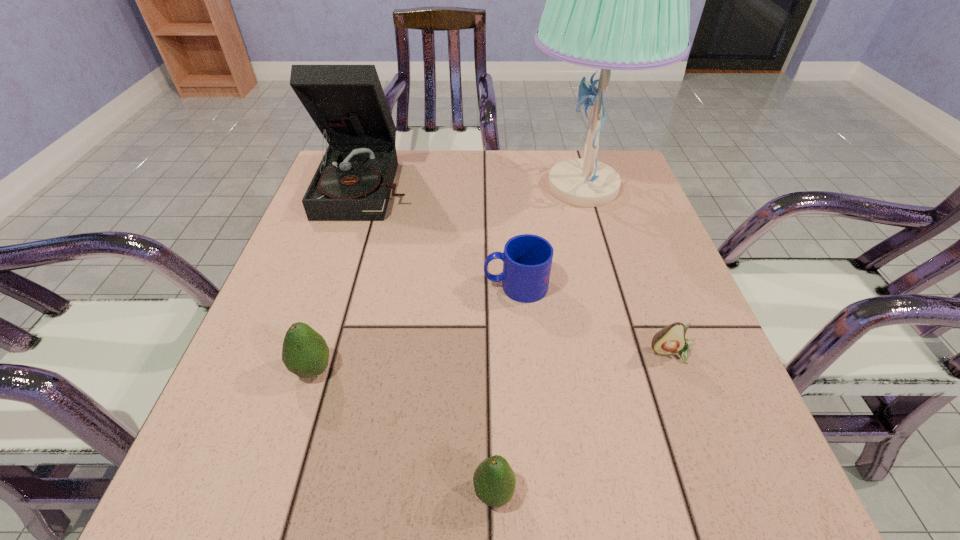
You are a GUI agent. You are given a task and a screenshot of the screen. Output one action in this format:
    pyautogui.click(x=<x>, y=<y>)
    Task: Click on the tallest object
    The height and width of the screenshot is (540, 960).
    Given the screenshot: What is the action you would take?
    pyautogui.click(x=616, y=0)

Image resolution: width=960 pixels, height=540 pixels. Identify the location of the second tallest object. (353, 182).

Where is `the tallest avocado`? The image size is (960, 540). the tallest avocado is located at coordinates (305, 353).

Image resolution: width=960 pixels, height=540 pixels. Identify the location of mug. (527, 259).

I want to click on the rightmost avocado, so click(671, 339).

Locate an element on the screen. the nearest avocado is located at coordinates (494, 481).

Locate an element on the screen. the second avocado from left to right is located at coordinates (494, 481).

In order to click on vacant area located 0.400m on the front of the tallest object in this screenshot , I will do coord(636,372).

At what (x,y) coordinates should I click in order to perform the action: click on free space located 0.390m on the front-facing side of the second tallest object. Please return your answer as a coordinate pair (x, y). Image resolution: width=960 pixels, height=540 pixels. Looking at the image, I should click on (311, 362).

Locate an element on the screen. Image resolution: width=960 pixels, height=540 pixels. free space located on the right of the tallest avocado is located at coordinates (512, 369).